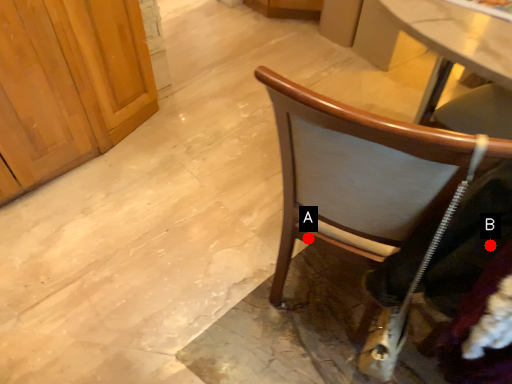
Question: Two points are circled on the image, labeled by A and B beside each circle. Which point is further to the camera?

Choices:
 (A) A is further
 (B) B is further

Answer: (A)